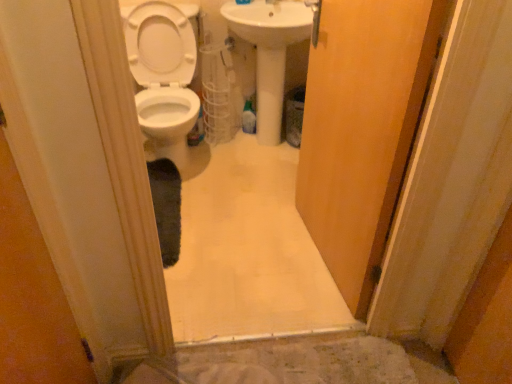
Question: Is white glossy sink at center not within white glossy toilet at left?

Choices:
 (A) yes
 (B) no

Answer: (A)

Question: Does white glossy sink at center contain white glossy toilet at left?

Choices:
 (A) yes
 (B) no

Answer: (B)

Question: From a real-world perspective, is white glossy sink at center beneath white glossy toilet at left?

Choices:
 (A) no
 (B) yes

Answer: (A)

Question: Is white glossy sink at center shorter than white glossy toilet at left?

Choices:
 (A) no
 (B) yes

Answer: (A)

Question: Does white glossy sink at center appear on the left side of white glossy toilet at left?

Choices:
 (A) yes
 (B) no

Answer: (B)

Question: Are white glossy sink at center and white glossy toilet at left beside each other?

Choices:
 (A) yes
 (B) no

Answer: (B)

Question: Is white glossy toilet at left located outside wooden door at center?

Choices:
 (A) yes
 (B) no

Answer: (A)

Question: Is white glossy toilet at left to the left of wooden door at center from the viewer's perspective?

Choices:
 (A) yes
 (B) no

Answer: (A)

Question: Does white glossy toilet at left have a larger size compared to wooden door at center?

Choices:
 (A) no
 (B) yes

Answer: (B)

Question: From a real-world perspective, is white glossy toilet at left below wooden door at center?

Choices:
 (A) yes
 (B) no

Answer: (A)

Question: Is white glossy toilet at left touching wooden door at center?

Choices:
 (A) yes
 (B) no

Answer: (B)

Question: Is white glossy toilet at left wider than wooden door at center?

Choices:
 (A) yes
 (B) no

Answer: (A)

Question: Would you say wooden door at center contains white glossy sink at center?

Choices:
 (A) no
 (B) yes

Answer: (A)